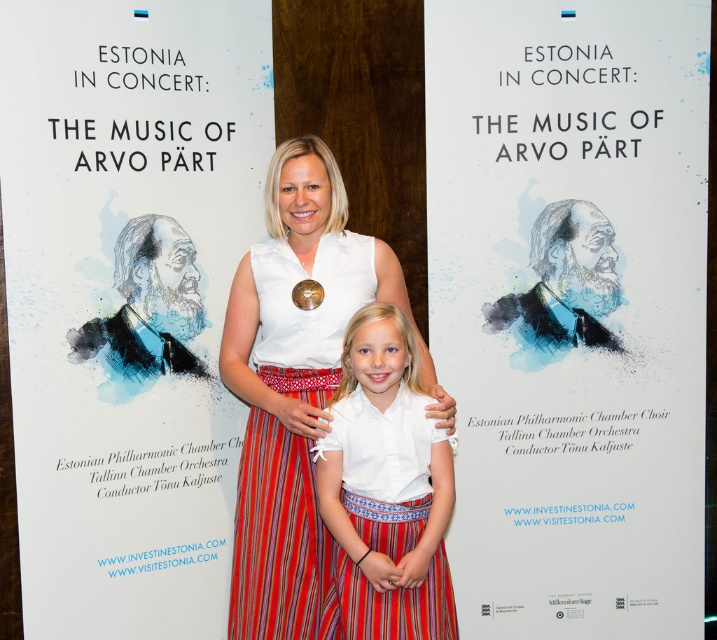
Who is higher up, blue watercolor portrait at center or white cotton blouse at center?

blue watercolor portrait at center

Can you confirm if blue watercolor portrait at center is shorter than white cotton blouse at center?

In fact, blue watercolor portrait at center may be taller than white cotton blouse at center.

The width and height of the screenshot is (717, 640). I want to click on blue watercolor portrait at center, so point(571,308).

The height and width of the screenshot is (640, 717). What are the coordinates of `blue watercolor portrait at center` in the screenshot? It's located at (571, 308).

Who is higher up, blue watercolor portrait at center or white paper at center?

white paper at center

Between blue watercolor portrait at center and white paper at center, which one has less height?

With less height is white paper at center.

Which is behind, point (599, 188) or point (87, 157)?

Positioned behind is point (599, 188).

Find the location of a particular element. blue watercolor portrait at center is located at coordinates (571, 308).

Is point (457, 182) positioned before point (427, 596)?

No, it is behind (427, 596).

Between point (526, 442) and point (394, 563), which one is positioned in front?

Point (394, 563) is in front.

Locate an element on the screen. The height and width of the screenshot is (640, 717). blue watercolor portrait at center is located at coordinates (571, 308).